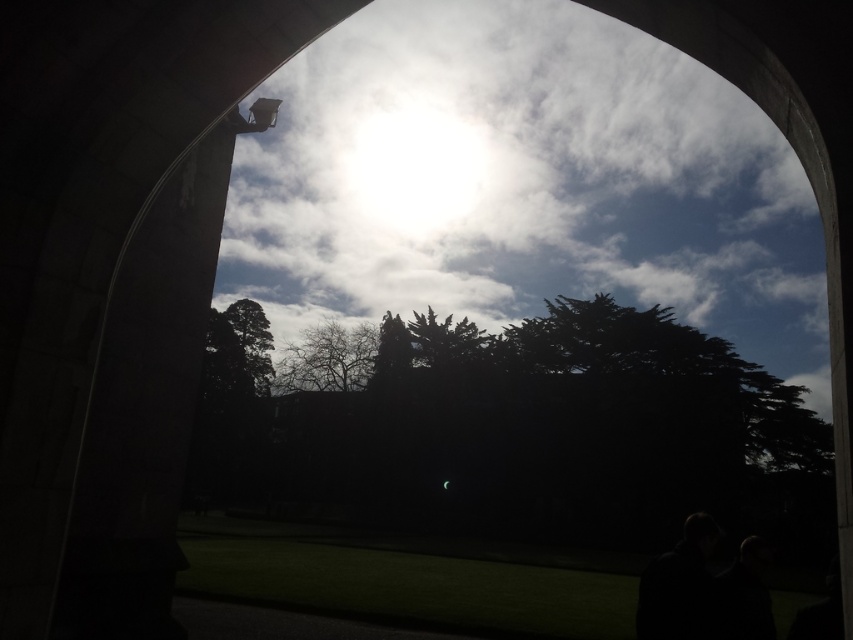
Is green leafy tree at center taller than bare branches at center?

Yes, green leafy tree at center is taller than bare branches at center.

Which is more to the left, green leafy tree at center or bare branches at center?

bare branches at center is more to the left.

The height and width of the screenshot is (640, 853). Describe the element at coordinates (518, 429) in the screenshot. I see `green leafy tree at center` at that location.

Locate an element on the screen. The width and height of the screenshot is (853, 640). green leafy tree at center is located at coordinates (518, 429).